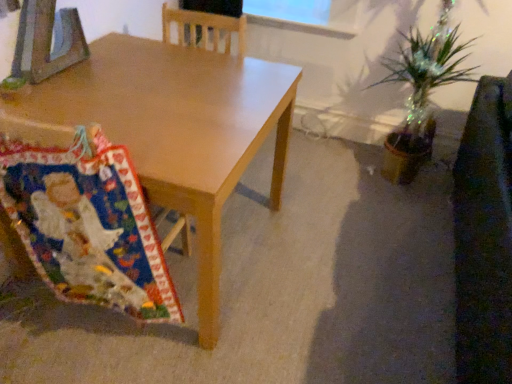
Describe the element at coordinates (178, 130) in the screenshot. I see `matte wood desk at center` at that location.

Describe the element at coordinates (87, 225) in the screenshot. This screenshot has width=512, height=384. I see `multicolored fabric at lower left` at that location.

Locate an element on the screen. This screenshot has height=384, width=512. dark brown leather swivel chair at right is located at coordinates (484, 237).

You are a GUI agent. You are given a task and a screenshot of the screen. Output one action in this format:
    pyautogui.click(x=<x>, y=<y>)
    Task: Click on the matte wood desk at center
    Image resolution: width=512 pixels, height=384 pixels.
    Given the screenshot: What is the action you would take?
    pyautogui.click(x=178, y=130)

Looking at this image, from the image's perspective, who appears lower, dark brown leather swivel chair at right or multicolored fabric at lower left?

multicolored fabric at lower left appears lower in the image.

Is dark brown leather swivel chair at right inside the boundaries of multicolored fabric at lower left, or outside?

dark brown leather swivel chair at right is located beyond the bounds of multicolored fabric at lower left.

Considering the sizes of objects dark brown leather swivel chair at right and multicolored fabric at lower left in the image provided, who is bigger, dark brown leather swivel chair at right or multicolored fabric at lower left?

dark brown leather swivel chair at right.

Considering the positions of objects dark brown leather swivel chair at right and multicolored fabric at lower left in the image provided, who is more to the right, dark brown leather swivel chair at right or multicolored fabric at lower left?

From the viewer's perspective, dark brown leather swivel chair at right appears more on the right side.

You are a GUI agent. You are given a task and a screenshot of the screen. Output one action in this format:
    pyautogui.click(x=<x>, y=<y>)
    Task: Click on the desk on the left of dark brown leather swivel chair at right
    The image size is (512, 384).
    Given the screenshot: What is the action you would take?
    pyautogui.click(x=178, y=130)

Is matte wood desk at center a part of dark brown leather swivel chair at right?

No, matte wood desk at center is not surrounded by dark brown leather swivel chair at right.

Looking at this image, is there a large distance between dark brown leather swivel chair at right and matte wood desk at center?

No, dark brown leather swivel chair at right is not far away from matte wood desk at center.

Between matte wood desk at center and multicolored fabric at lower left, which one has larger size?

Bigger between the two is matte wood desk at center.

Is matte wood desk at center not inside multicolored fabric at lower left?

matte wood desk at center lies outside multicolored fabric at lower left's area.

Could you tell me if matte wood desk at center is facing multicolored fabric at lower left?

No, matte wood desk at center is not facing towards multicolored fabric at lower left.

Consider the image. From the image's perspective, relative to multicolored fabric at lower left, is matte wood desk at center above or below?

matte wood desk at center is above multicolored fabric at lower left.

From a real-world perspective, is multicolored fabric at lower left positioned under dark brown leather swivel chair at right based on gravity?

No, from a real-world perspective, multicolored fabric at lower left is not below dark brown leather swivel chair at right.

How different are the orientations of multicolored fabric at lower left and dark brown leather swivel chair at right in degrees?

The facing directions of multicolored fabric at lower left and dark brown leather swivel chair at right are 81.5 degrees apart.

From the image's perspective, would you say multicolored fabric at lower left is positioned over dark brown leather swivel chair at right?

No, from the image's perspective, multicolored fabric at lower left is not on top of dark brown leather swivel chair at right.

Is matte wood desk at center bigger or smaller than dark brown leather swivel chair at right?

matte wood desk at center is bigger than dark brown leather swivel chair at right.

Is matte wood desk at center completely or partially outside of dark brown leather swivel chair at right?

That's correct, matte wood desk at center is outside of dark brown leather swivel chair at right.

From a real-world perspective, is matte wood desk at center located beneath dark brown leather swivel chair at right?

Correct, in the physical world, matte wood desk at center is lower than dark brown leather swivel chair at right.

From the image's perspective, is matte wood desk at center above dark brown leather swivel chair at right?

Indeed, from the image's perspective, matte wood desk at center is shown above dark brown leather swivel chair at right.

From the image's perspective, between multicolored fabric at lower left and matte wood desk at center, which one is located above?

matte wood desk at center is shown above in the image.

From the picture: Which object is positioned more to the left, multicolored fabric at lower left or matte wood desk at center?

multicolored fabric at lower left.

Between multicolored fabric at lower left and matte wood desk at center, which one has larger size?

matte wood desk at center is bigger.

In order to click on swivel chair below the multicolored fabric at lower left (from a real-world perspective) in this screenshot , I will do `click(484, 237)`.

Where is `desk located behind the dark brown leather swivel chair at right`? This screenshot has height=384, width=512. desk located behind the dark brown leather swivel chair at right is located at coordinates (178, 130).

Looking at the image, which one is located closer to dark brown leather swivel chair at right, matte wood desk at center or multicolored fabric at lower left?

matte wood desk at center.

Based on their spatial positions, is multicolored fabric at lower left or matte wood desk at center closer to dark brown leather swivel chair at right?

matte wood desk at center is positioned closer to the anchor dark brown leather swivel chair at right.

Based on their spatial positions, is multicolored fabric at lower left or dark brown leather swivel chair at right further from matte wood desk at center?

dark brown leather swivel chair at right is further to matte wood desk at center.

Looking at the image, which one is located further to multicolored fabric at lower left, dark brown leather swivel chair at right or matte wood desk at center?

dark brown leather swivel chair at right is positioned further to the anchor multicolored fabric at lower left.

When comparing their distances from matte wood desk at center, does dark brown leather swivel chair at right or multicolored fabric at lower left seem closer?

Among the two, multicolored fabric at lower left is located nearer to matte wood desk at center.

Which object lies nearer to the anchor point multicolored fabric at lower left, matte wood desk at center or dark brown leather swivel chair at right?

matte wood desk at center.

This screenshot has height=384, width=512. What are the coordinates of `desk between multicolored fabric at lower left and dark brown leather swivel chair at right from left to right` in the screenshot? It's located at (x=178, y=130).